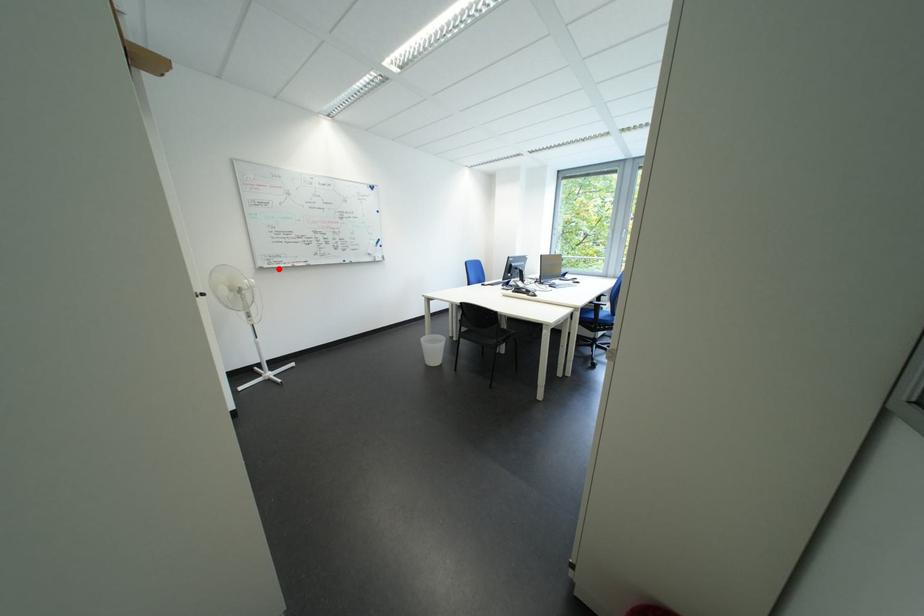
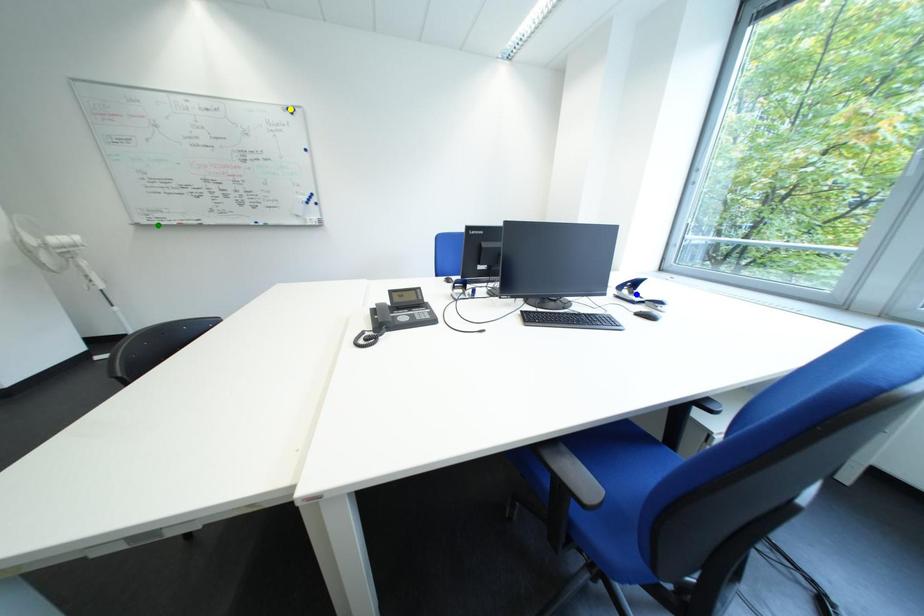
Question: I am providing you with two images of the same scene from different viewpoints. A red point is marked on the first image. You are given multiple points on the second image. Which point in image 2 represents the same 3d spot as the red point in image 1?

Choices:
 (A) yellow point
 (B) green point
 (C) blue point

Answer: (B)